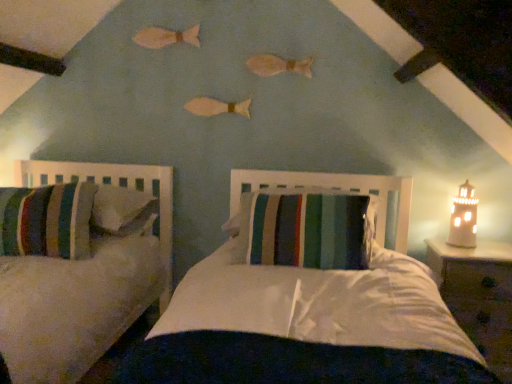
Question: Does striped fabric pillow at center have a lesser width compared to wooden nightstand at right?

Choices:
 (A) no
 (B) yes

Answer: (A)

Question: Is striped fabric pillow at center bigger than wooden nightstand at right?

Choices:
 (A) yes
 (B) no

Answer: (B)

Question: Is striped fabric pillow at center oriented towards wooden nightstand at right?

Choices:
 (A) yes
 (B) no

Answer: (B)

Question: Is striped fabric pillow at center completely or partially outside of wooden nightstand at right?

Choices:
 (A) no
 (B) yes

Answer: (B)

Question: From a real-world perspective, is striped fabric pillow at center below wooden nightstand at right?

Choices:
 (A) yes
 (B) no

Answer: (B)

Question: From the image's perspective, is striped fabric pillow at center located above wooden nightstand at right?

Choices:
 (A) no
 (B) yes

Answer: (B)

Question: From the image's perspective, would you say white ceramic lighthouse at right is shown under wooden nightstand at right?

Choices:
 (A) no
 (B) yes

Answer: (A)

Question: Are white ceramic lighthouse at right and wooden nightstand at right beside each other?

Choices:
 (A) yes
 (B) no

Answer: (B)

Question: Does white ceramic lighthouse at right have a greater height compared to wooden nightstand at right?

Choices:
 (A) yes
 (B) no

Answer: (B)

Question: From the image's perspective, is white ceramic lighthouse at right on wooden nightstand at right?

Choices:
 (A) no
 (B) yes

Answer: (B)

Question: Considering the relative sizes of white ceramic lighthouse at right and wooden nightstand at right in the image provided, is white ceramic lighthouse at right wider than wooden nightstand at right?

Choices:
 (A) yes
 (B) no

Answer: (B)

Question: Does white ceramic lighthouse at right have a larger size compared to wooden nightstand at right?

Choices:
 (A) no
 (B) yes

Answer: (A)

Question: Is white ceramic lighthouse at right surrounded by wooden nightstand at right?

Choices:
 (A) no
 (B) yes

Answer: (A)